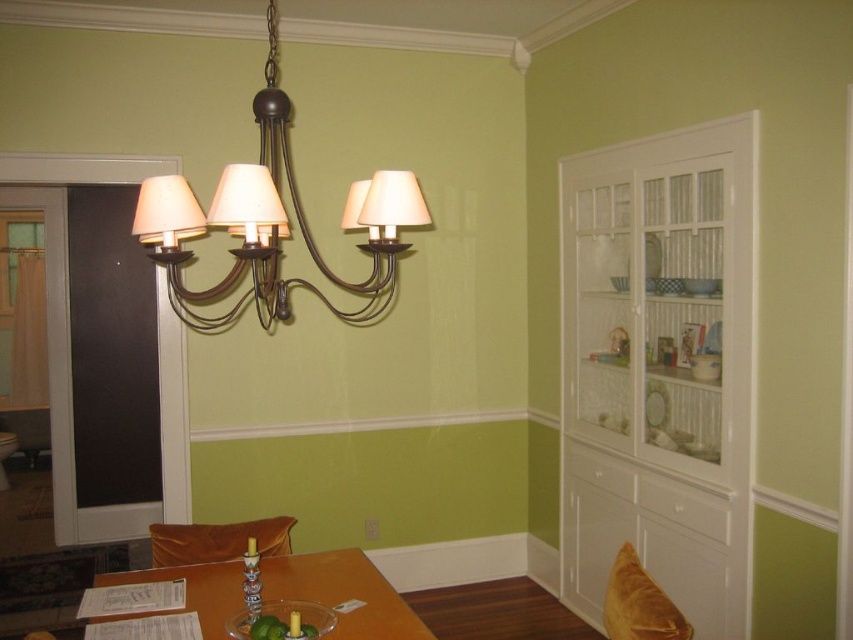
You are standing in the dining area and want to place a rectangular cake that is 1.5 meters long on the wooden table at center. Considering the distance between you and the table, can you easily slide the cake onto the table without needing to move closer?

The wooden table at center and camera are 1.82 meters apart. Since the cake is 1.5 meters long, you can easily slide it onto the table from your current position without needing to move closer.